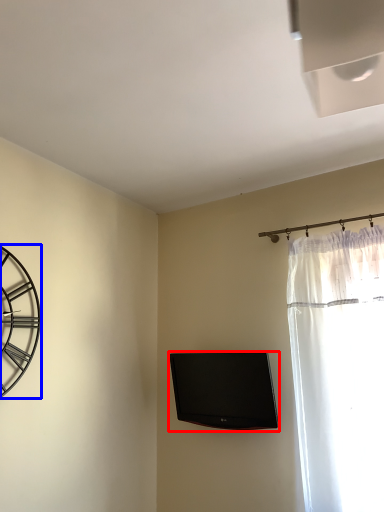
Question: Which of the following is the closest to the observer, television (highlighted by a red box) or wall clock (highlighted by a blue box)?

Choices:
 (A) television
 (B) wall clock

Answer: (B)